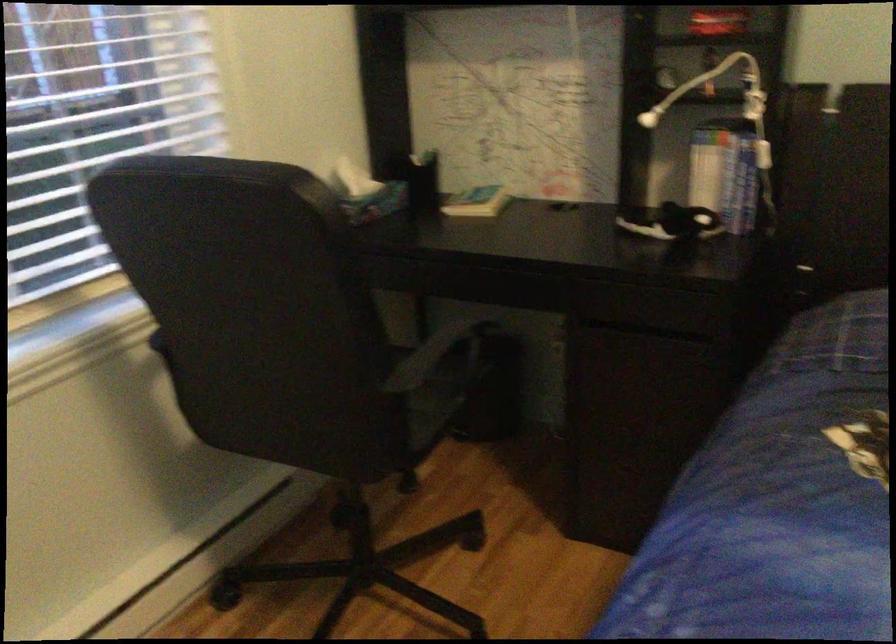
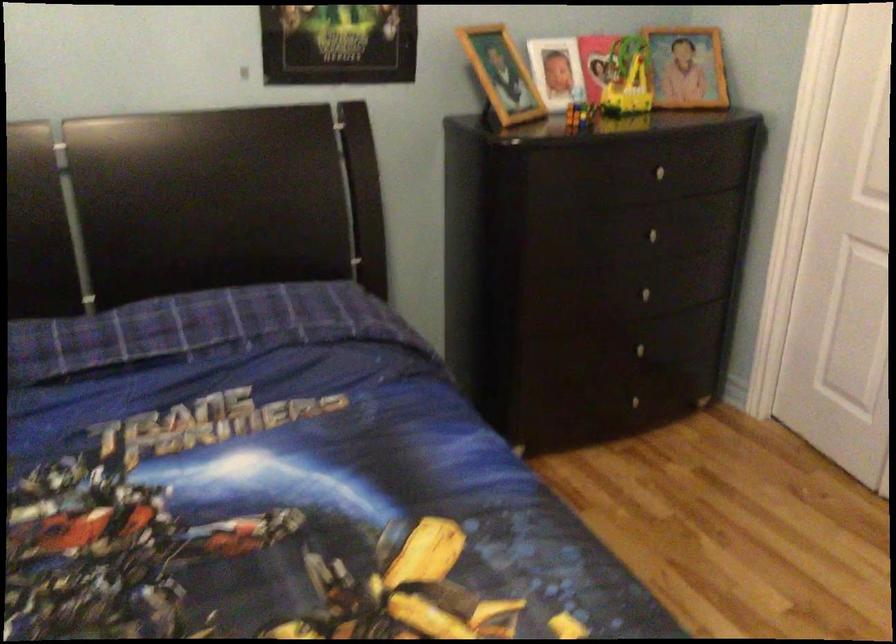
Question: The camera is either moving clockwise (left) or counter-clockwise (right) around the object. The first image is from the beginning of the video and the second image is from the end. Is the camera moving left or right when shooting the video?

Choices:
 (A) Left
 (B) Right

Answer: (A)